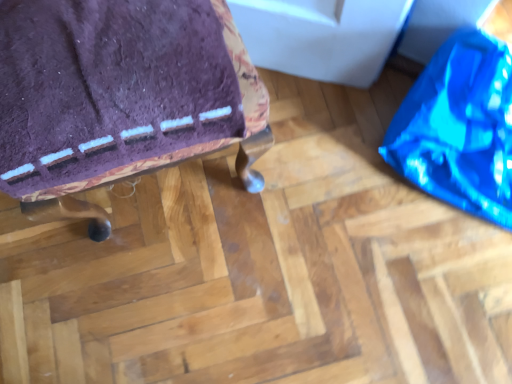
Question: From a real-world perspective, is purple fabric cushion at upper left positioned above or below shiny blue bean bag at right?

Choices:
 (A) below
 (B) above

Answer: (B)

Question: Is purple fabric cushion at upper left in front of or behind shiny blue bean bag at right in the image?

Choices:
 (A) front
 (B) behind

Answer: (A)

Question: Is purple fabric cushion at upper left to the left or to the right of shiny blue bean bag at right in the image?

Choices:
 (A) left
 (B) right

Answer: (A)

Question: Considering the positions of shiny blue bean bag at right and purple fabric cushion at upper left in the image, is shiny blue bean bag at right taller or shorter than purple fabric cushion at upper left?

Choices:
 (A) short
 (B) tall

Answer: (A)

Question: From a real-world perspective, is shiny blue bean bag at right physically located above or below purple fabric cushion at upper left?

Choices:
 (A) above
 (B) below

Answer: (B)

Question: In terms of width, does shiny blue bean bag at right look wider or thinner when compared to purple fabric cushion at upper left?

Choices:
 (A) wide
 (B) thin

Answer: (A)

Question: From the image's perspective, is shiny blue bean bag at right positioned above or below purple fabric cushion at upper left?

Choices:
 (A) below
 (B) above

Answer: (B)